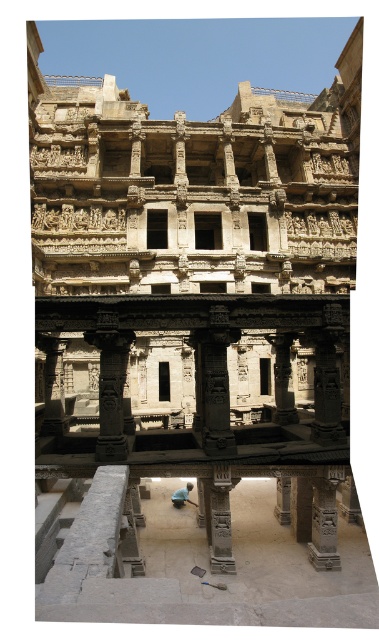
Can you confirm if carved stone pillar at center is positioned to the left of light blue fabric at center?

Correct, you'll find carved stone pillar at center to the left of light blue fabric at center.

What are the coordinates of `carved stone pillar at center` in the screenshot? It's located at (112, 387).